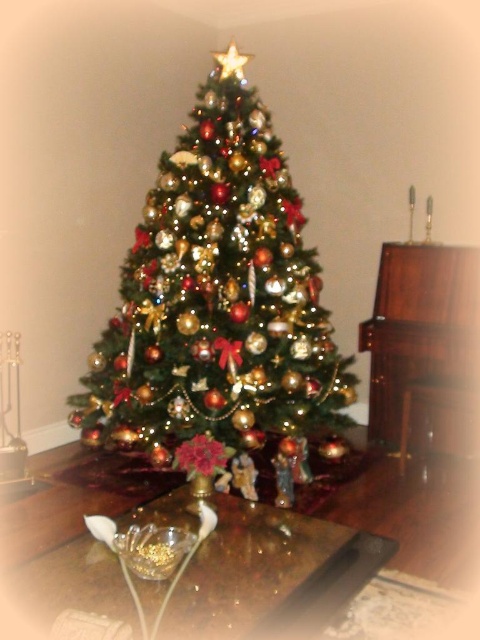
You are a guest at a Christmas party and want to place a small gift under the Christmas tree. You have a choice between placing it on the shiny gold ornaments at center or the transparent glass bowl at center. Which object can you place the gift on without it being too unstable?

The transparent glass bowl at center is shorter than the shiny gold ornaments at center, so placing the gift on the transparent glass bowl at center would be more stable as it has a wider base.

You are planning to place a new ornament on the coffee table. Given that the shiny gold ornaments at center are wider than the transparent glass bowl at center, which object should you avoid placing near the edge of the table to prevent it from falling off?

You should avoid placing the shiny gold ornaments at center near the edge of the table because they are wider than the transparent glass bowl at center, making them more prone to tipping over if placed too close to the edge.